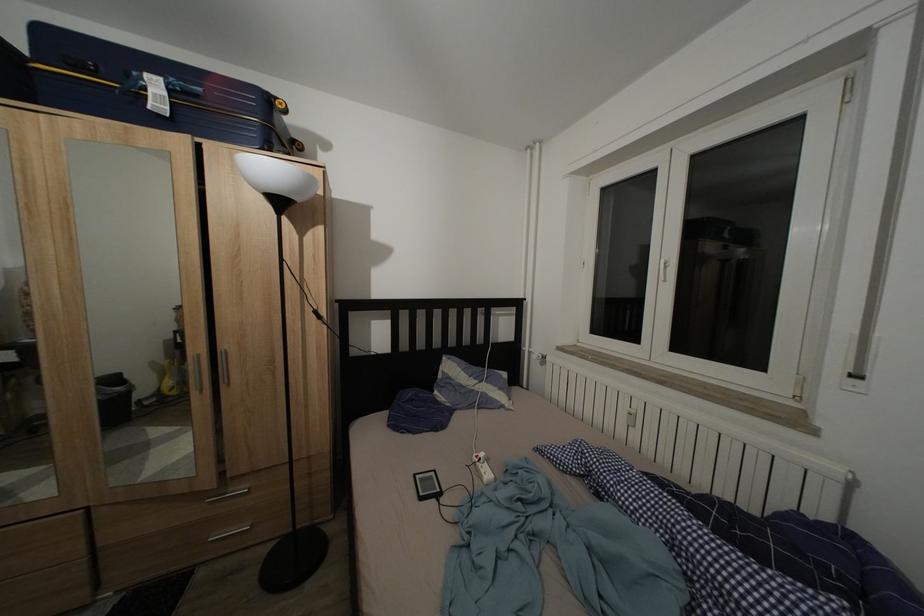
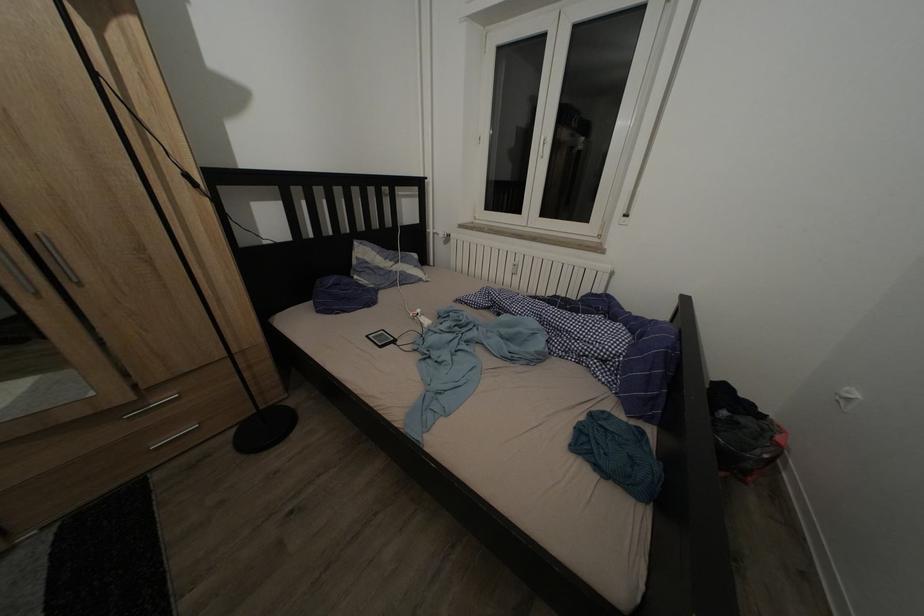
First-person continuous shooting, in which direction is the camera rotating?

The camera rotated toward right-down.